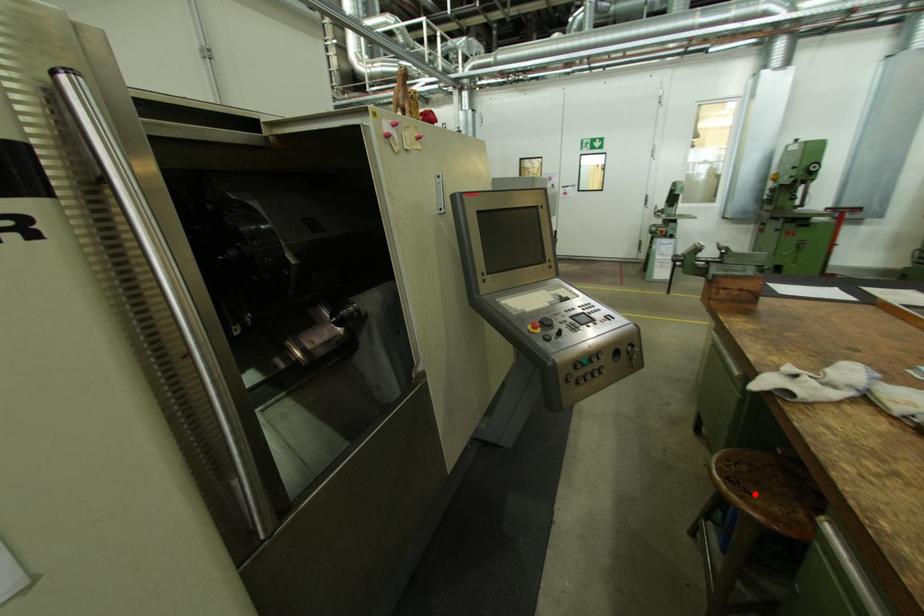
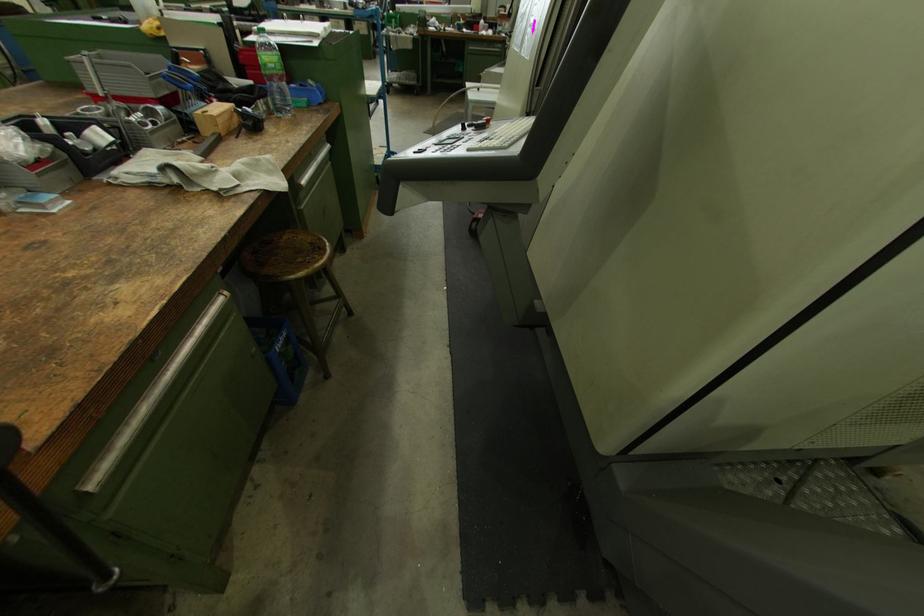
The point at the highlighted location is marked in the first image. Where is the corresponding point in the second image?

(317, 244)